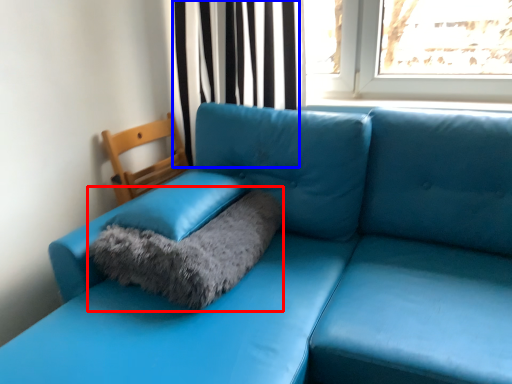
Question: Which point is further to the camera, cat bed (highlighted by a red box) or curtain (highlighted by a blue box)?

Choices:
 (A) cat bed
 (B) curtain

Answer: (B)